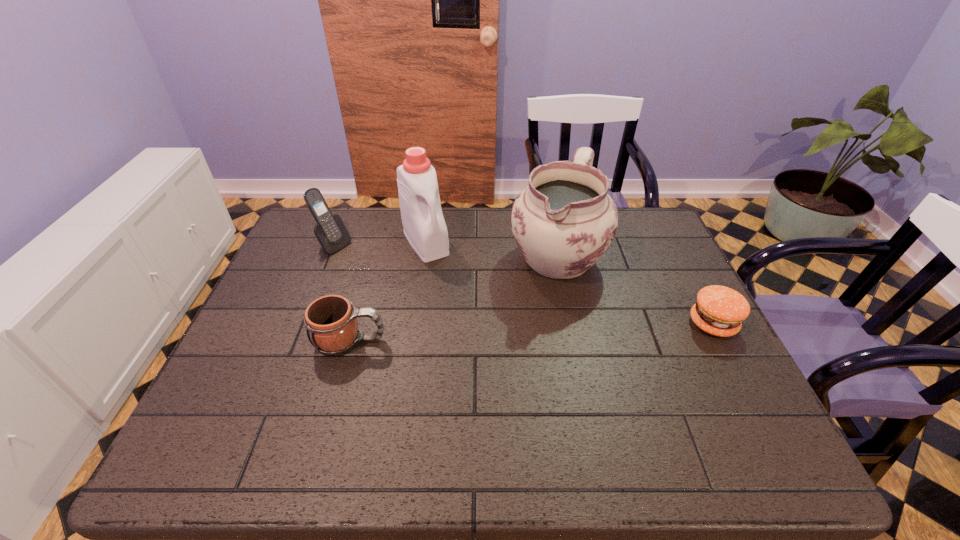
What are the coordinates of `blank space that satisfies the following two spatial constraints: 1. on the front side of the second object from right to left; 2. on the right side of the third shortest object` in the screenshot? It's located at (329, 255).